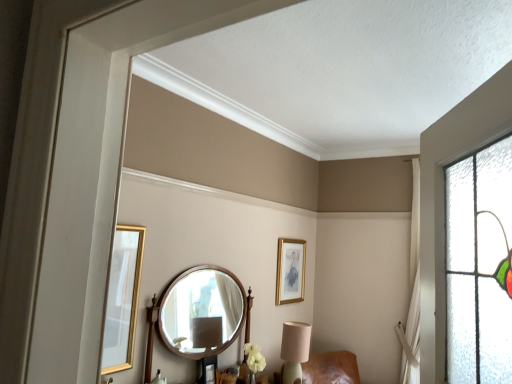
Question: Considering the positions of wooden round mirror at center and matte beige table lamp at lower center in the image, is wooden round mirror at center bigger or smaller than matte beige table lamp at lower center?

Choices:
 (A) big
 (B) small

Answer: (A)

Question: From the image's perspective, is wooden round mirror at center above or below matte beige table lamp at lower center?

Choices:
 (A) below
 (B) above

Answer: (B)

Question: Which object is positioned farthest from the wooden round mirror at center?

Choices:
 (A) gold-framed picture at upper center
 (B) matte beige table lamp at lower center

Answer: (A)

Question: Which object is the closest to the wooden round mirror at center?

Choices:
 (A) gold-framed picture at upper center
 (B) matte beige table lamp at lower center

Answer: (B)